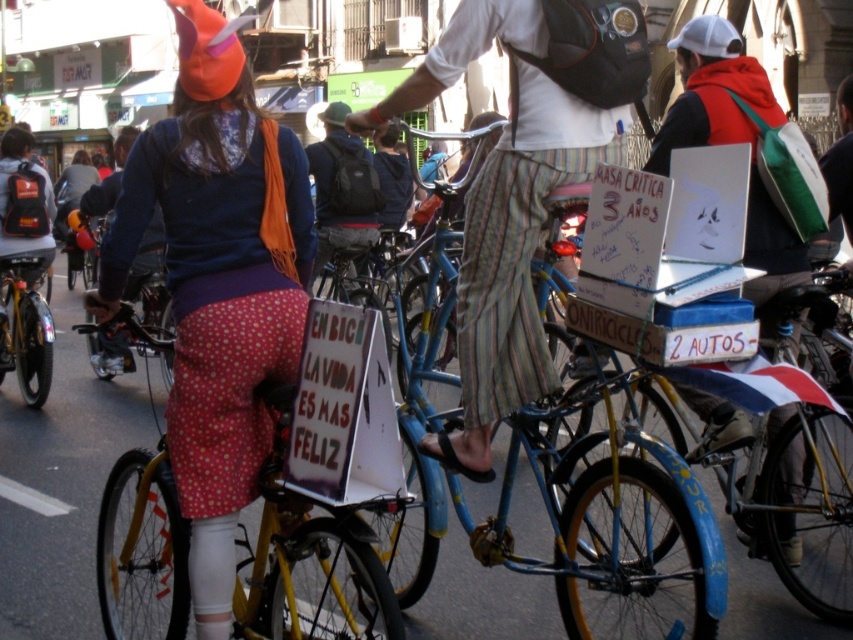
Question: Is striped cotton pants at center smaller than shiny metallic bicycle at left?

Choices:
 (A) yes
 (B) no

Answer: (B)

Question: Among these objects, which one is nearest to the camera?

Choices:
 (A) shiny metallic bicycle at left
 (B) dark gray backpack at center
 (C) matte blue jacket at center

Answer: (C)

Question: Among these objects, which one is nearest to the camera?

Choices:
 (A) polka dot fabric pants at center
 (B) yellow matte bicycle at center
 (C) shiny metallic bicycle at left
 (D) white matte laptop at upper right

Answer: (B)

Question: Is polka dot fabric pants at center wider than shiny metallic bicycle at left?

Choices:
 (A) yes
 (B) no

Answer: (A)

Question: Which point appears farthest from the camera in this image?

Choices:
 (A) pyautogui.click(x=86, y=192)
 (B) pyautogui.click(x=751, y=216)
 (C) pyautogui.click(x=454, y=465)
 (D) pyautogui.click(x=345, y=193)

Answer: (A)

Question: Can you confirm if polka dot fabric pants at center is wider than matte blue jacket at center?

Choices:
 (A) no
 (B) yes

Answer: (A)